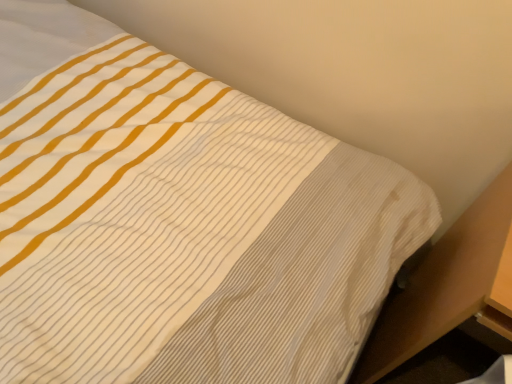
In order to click on wooden table at lower right in this screenshot , I will do `click(447, 285)`.

Image resolution: width=512 pixels, height=384 pixels. What do you see at coordinates (447, 285) in the screenshot?
I see `wooden table at lower right` at bounding box center [447, 285].

Find the location of `wooden table at lower right`. wooden table at lower right is located at coordinates (447, 285).